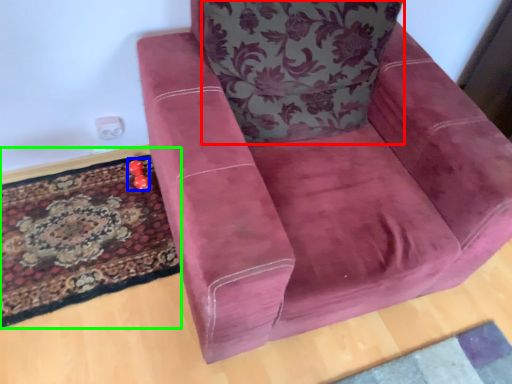
Question: Estimate the real-world distances between objects in this image. Which object is farther from throw pillow (highlighted by a red box), toy (highlighted by a blue box) or mat (highlighted by a green box)?

Choices:
 (A) toy
 (B) mat

Answer: (A)